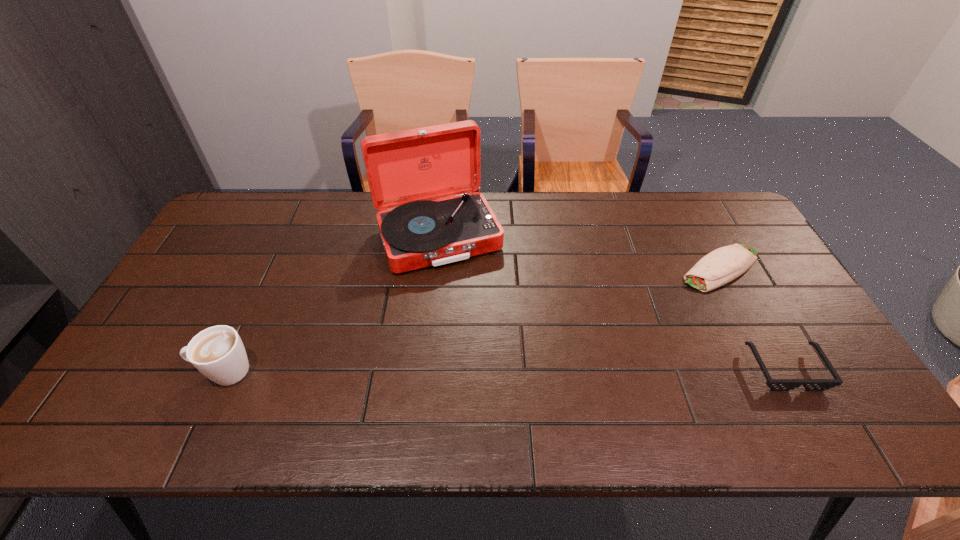
At what (x,y) coordinates should I click in order to perform the action: click on free space between the burrito and the second object from left to right. Please return your answer as a coordinate pair (x, y). Looking at the image, I should click on (579, 252).

The height and width of the screenshot is (540, 960). Find the location of `empty location between the second object from left to right and the sunglasses`. empty location between the second object from left to right and the sunglasses is located at coordinates click(x=612, y=302).

You are a GUI agent. You are given a task and a screenshot of the screen. Output one action in this format:
    pyautogui.click(x=<x>, y=<y>)
    Task: Click on the free space between the sunglasses and the leftmost object
    The height and width of the screenshot is (540, 960).
    Given the screenshot: What is the action you would take?
    pyautogui.click(x=505, y=370)

Image resolution: width=960 pixels, height=540 pixels. In order to click on free space between the burrito and the sunglasses in this screenshot , I will do `click(753, 318)`.

Point out which object is positioned as the nearest to the leftmost object. Please provide its 2D coordinates. Your answer should be formatted as a tuple, i.e. [(x, y)], where the tuple contains the x and y coordinates of a point satisfying the conditions above.

[(406, 169)]

This screenshot has height=540, width=960. What are the coordinates of `object that is the second nearest to the cappuccino` in the screenshot? It's located at (719, 267).